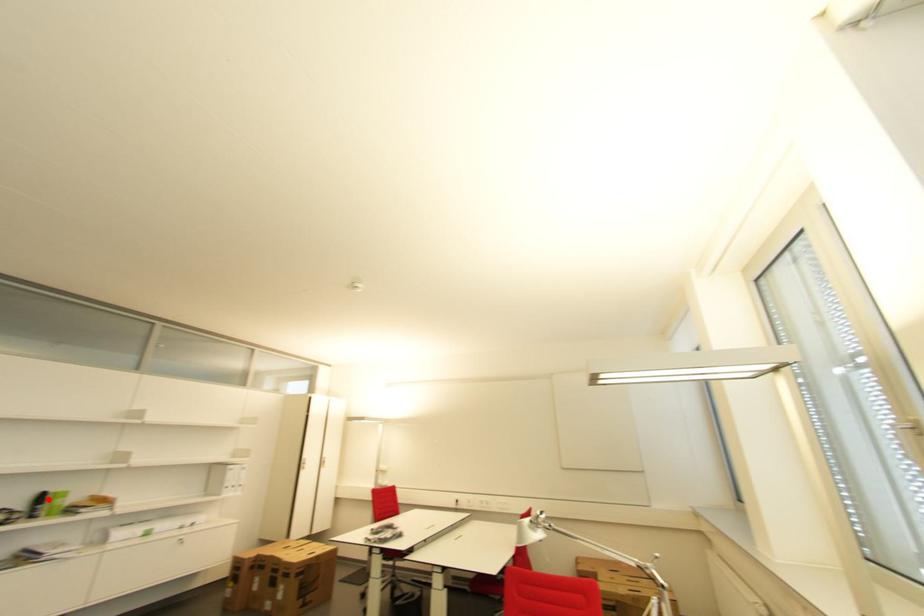
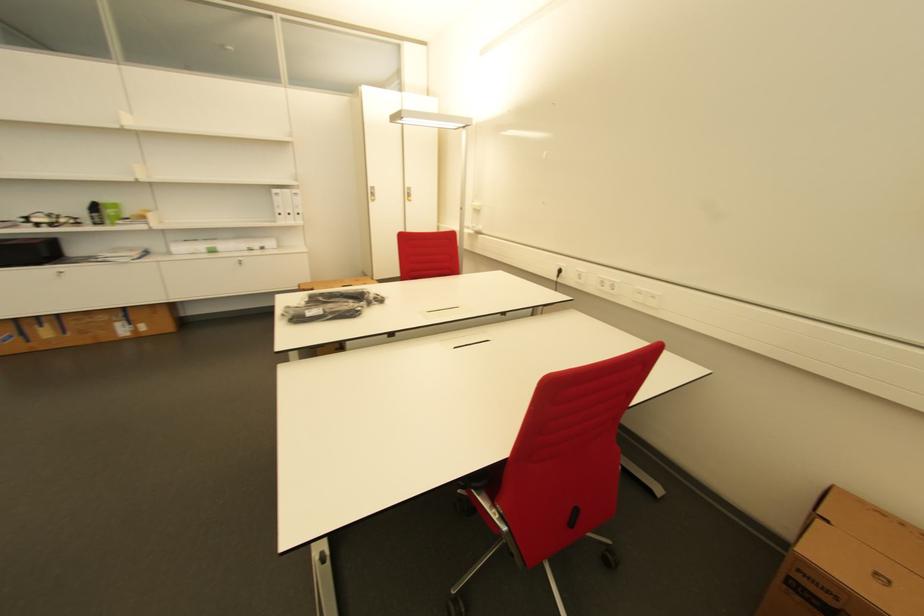
Locate, in the second image, the point that corresponds to the highlighted location in the first image.

(100, 209)